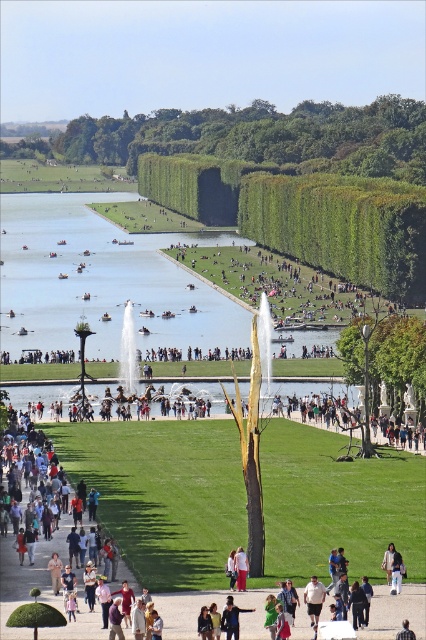
Question: Estimate the real-world distances between objects in this image. Which object is closer to the brown plaid shirt at center?

Choices:
 (A) white cotton shirt at center
 (B) white cotton shirt at lower center

Answer: (B)

Question: Estimate the real-world distances between objects in this image. Which object is farther from the brown plaid shirt at center?

Choices:
 (A) green leafy tree at upper center
 (B) white cotton shirt at center
 (C) white cotton shirt at lower center

Answer: (A)

Question: Which object is closer to the camera taking this photo?

Choices:
 (A) white cotton shirt at center
 (B) white cotton shirt at lower center

Answer: (B)

Question: Where is white cotton shirt at center located in relation to brown plaid shirt at center in the image?

Choices:
 (A) above
 (B) below

Answer: (A)

Question: Is white cotton shirt at center above brown plaid shirt at center?

Choices:
 (A) no
 (B) yes

Answer: (B)

Question: Can you confirm if white cotton shirt at lower center is positioned to the left of brown plaid shirt at center?

Choices:
 (A) yes
 (B) no

Answer: (A)